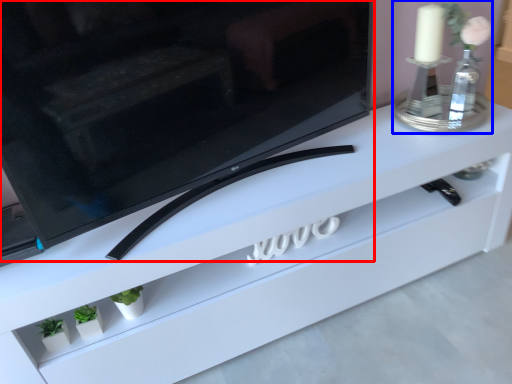
Question: Among these objects, which one is nearest to the camera, television (highlighted by a red box) or candle holder (highlighted by a blue box)?

Choices:
 (A) television
 (B) candle holder

Answer: (A)